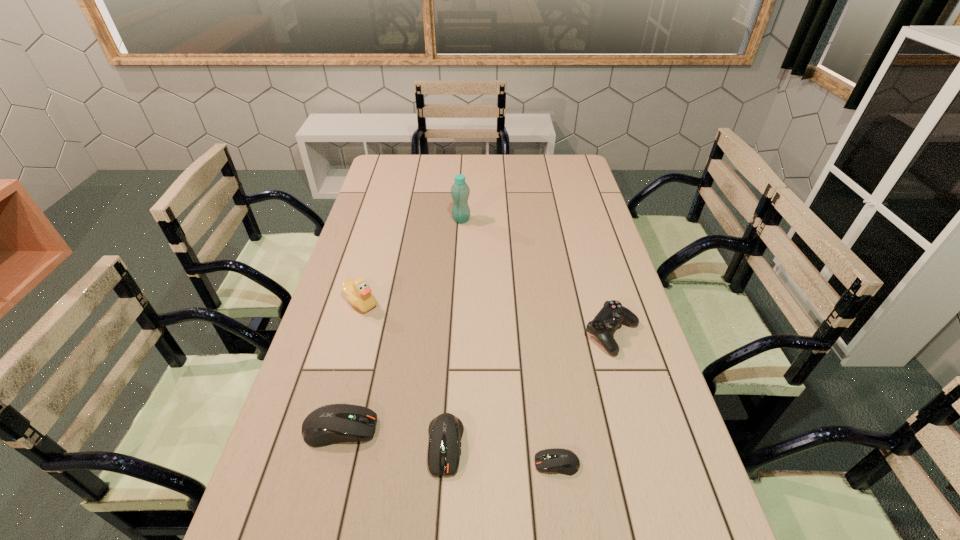
Find the location of a particular element. The image size is (960, 540). vacant area that satisfies the following two spatial constraints: 1. at the front cap of the water bottle; 2. on the button of the second shortest object is located at coordinates (448, 446).

Identify the location of blank area in the image that satisfies the following two spatial constraints: 1. on the back side of the rightmost object; 2. at the front cap of the farthest object. (579, 220).

Image resolution: width=960 pixels, height=540 pixels. I want to click on free spot that satisfies the following two spatial constraints: 1. at the front cap of the farthest object; 2. on the button of the second computer equipment from left to right, so click(x=448, y=446).